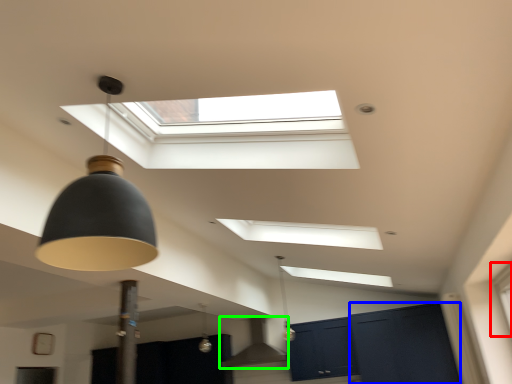
Question: Which object is the farthest from window (highlighted by a red box)? Choose among these: glass door (highlighted by a blue box) or exhaust hood (highlighted by a green box).

Choices:
 (A) glass door
 (B) exhaust hood

Answer: (B)